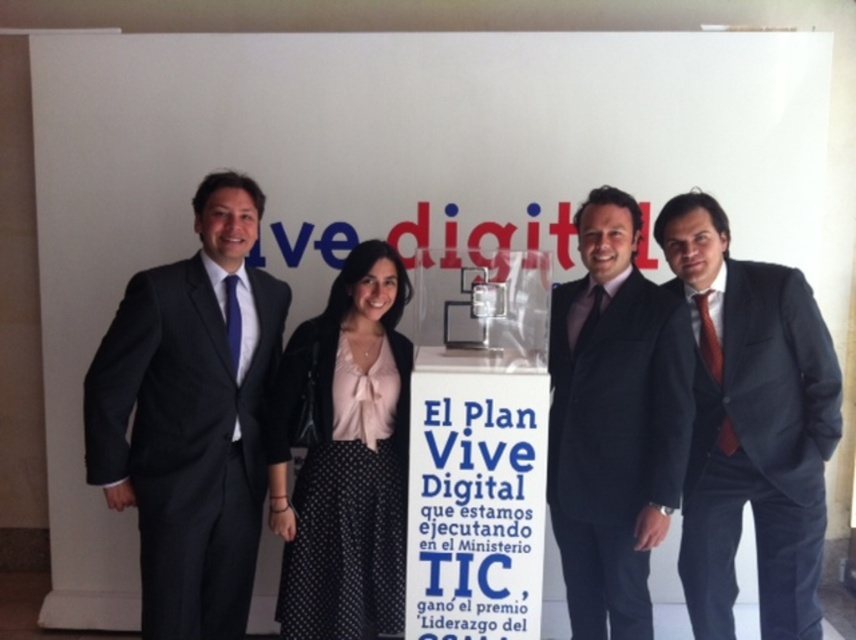
Question: Which object is the farthest from the dark gray suit at center?

Choices:
 (A) dark gray suit at left
 (B) black polka dot skirt at center
 (C) matte black suit at right

Answer: (A)

Question: Estimate the real-world distances between objects in this image. Which object is farther from the dark gray suit at center?

Choices:
 (A) matte black suit at right
 (B) black polka dot skirt at center
 (C) dark gray suit at left

Answer: (C)

Question: Does dark gray suit at left appear on the right side of dark gray suit at center?

Choices:
 (A) no
 (B) yes

Answer: (A)

Question: Which point appears farthest from the camera in this image?

Choices:
 (A) tap(678, 244)
 (B) tap(247, 317)
 (C) tap(305, 340)

Answer: (C)

Question: Is dark gray suit at left above dark gray suit at center?

Choices:
 (A) no
 (B) yes

Answer: (B)

Question: Is matte black suit at right wider than dark gray suit at center?

Choices:
 (A) no
 (B) yes

Answer: (B)